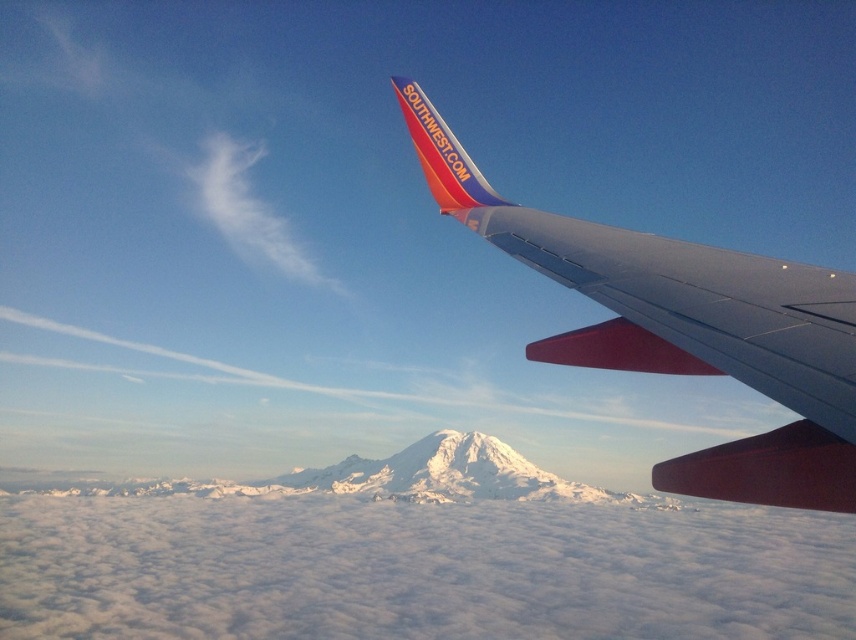
Question: Among these points, which one is nearest to the camera?

Choices:
 (A) (217, 172)
 (B) (783, 364)
 (C) (479, 188)
 (D) (569, 234)

Answer: (B)

Question: Which object is closer to the camera taking this photo?

Choices:
 (A) white cotton cloud at upper left
 (B) smooth metallic wing at upper right

Answer: (B)

Question: Can you confirm if white cotton cloud at upper left is thinner than matte plastic airplane winglet at upper right?

Choices:
 (A) no
 (B) yes

Answer: (A)

Question: Observing the image, what is the correct spatial positioning of smooth metallic wing at upper right in reference to white cotton cloud at upper left?

Choices:
 (A) below
 (B) above

Answer: (A)

Question: Does white cotton cloud at upper left have a larger size compared to matte plastic airplane winglet at upper right?

Choices:
 (A) no
 (B) yes

Answer: (B)

Question: Considering the real-world distances, which object is farthest from the white cotton cloud at upper left?

Choices:
 (A) metallic gray wing at upper right
 (B) smooth metallic wing at upper right
 (C) matte plastic airplane winglet at upper right

Answer: (B)